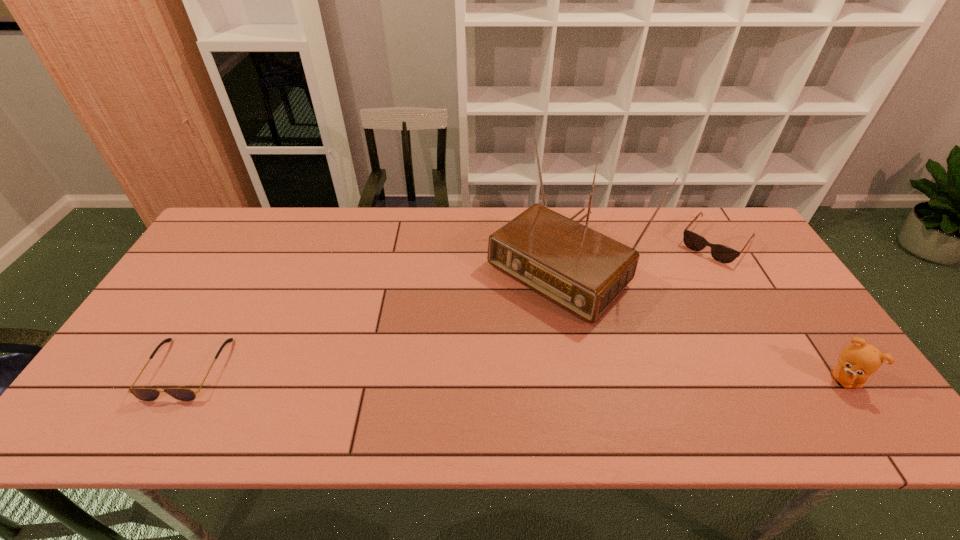
The height and width of the screenshot is (540, 960). I want to click on vacant point located 0.100m at the front lenses of the farther sunglasses, so click(687, 278).

This screenshot has width=960, height=540. In order to click on vacant space located at the front lenses of the farther sunglasses in this screenshot , I will do `click(686, 279)`.

Find the location of a particular element. radio_receiver that is at the far edge is located at coordinates (583, 271).

I want to click on sunglasses that is at the far edge, so click(x=721, y=253).

Locate an element on the screen. This screenshot has width=960, height=540. sunglasses at the near edge is located at coordinates (145, 394).

Identify the location of teddy bear that is at the near edge. The width and height of the screenshot is (960, 540). (858, 361).

Where is `object that is at the left edge`? The width and height of the screenshot is (960, 540). object that is at the left edge is located at coordinates pos(145,394).

The width and height of the screenshot is (960, 540). I want to click on teddy bear located in the right edge section of the desktop, so click(858, 361).

Identify the location of sunglasses at the right edge. 721,253.

You are a GUI agent. You are given a task and a screenshot of the screen. Output one action in this format:
    pyautogui.click(x=<x>, y=<y>)
    Task: Click on the object present at the near left corner
    This screenshot has height=540, width=960.
    Given the screenshot: What is the action you would take?
    pos(145,394)